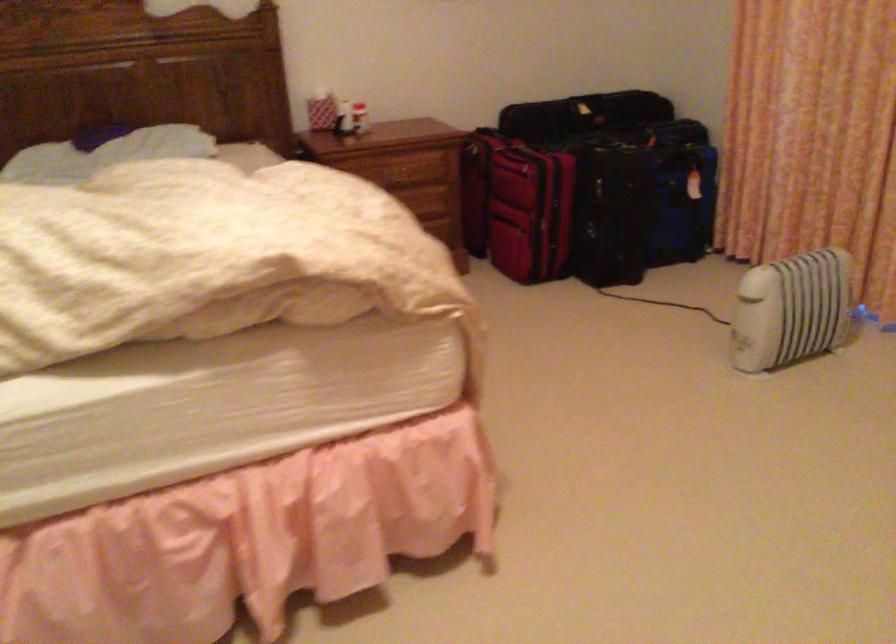
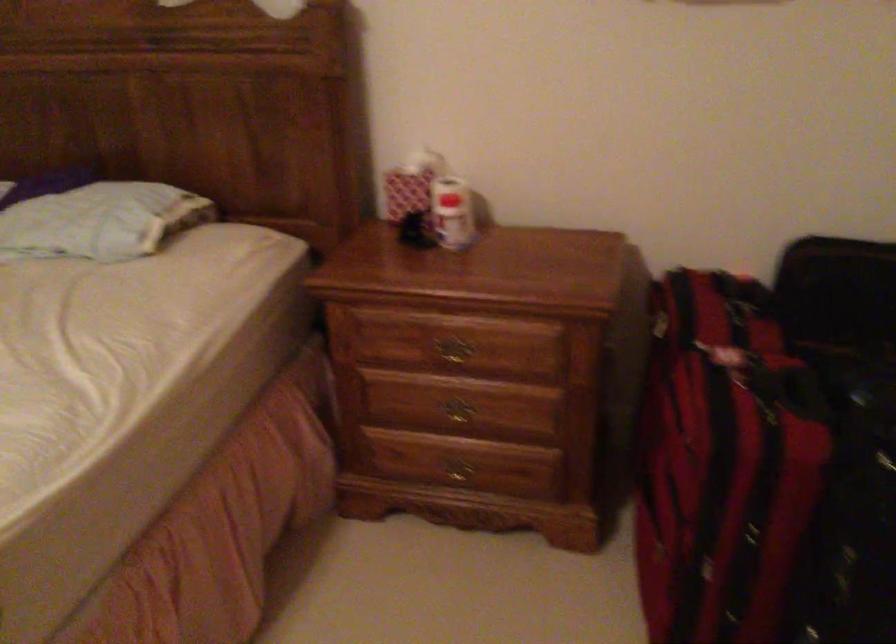
In the second image, find the point that corresponds to pixel 388 173 in the first image.

(452, 353)